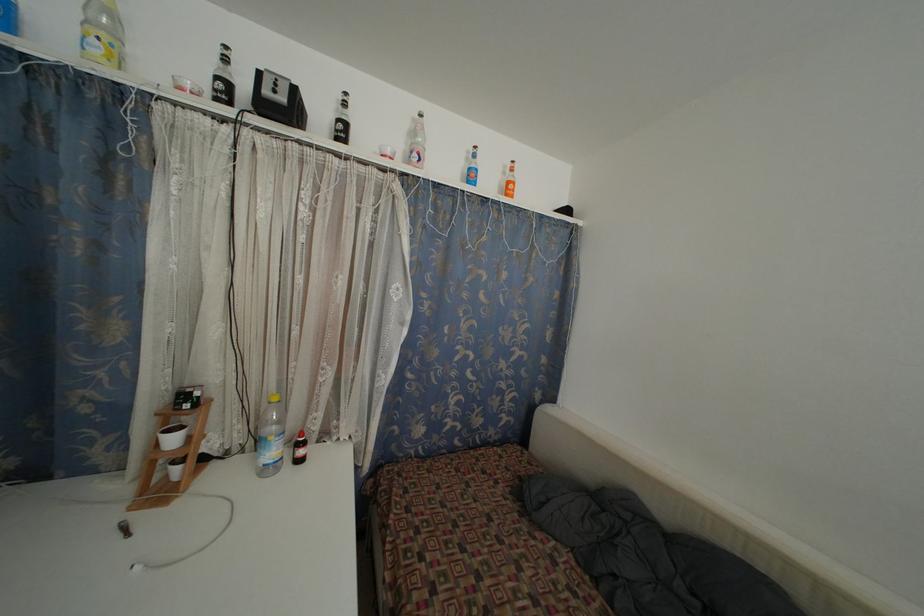
Where is `clear water bottle`? clear water bottle is located at coordinates (342, 120).